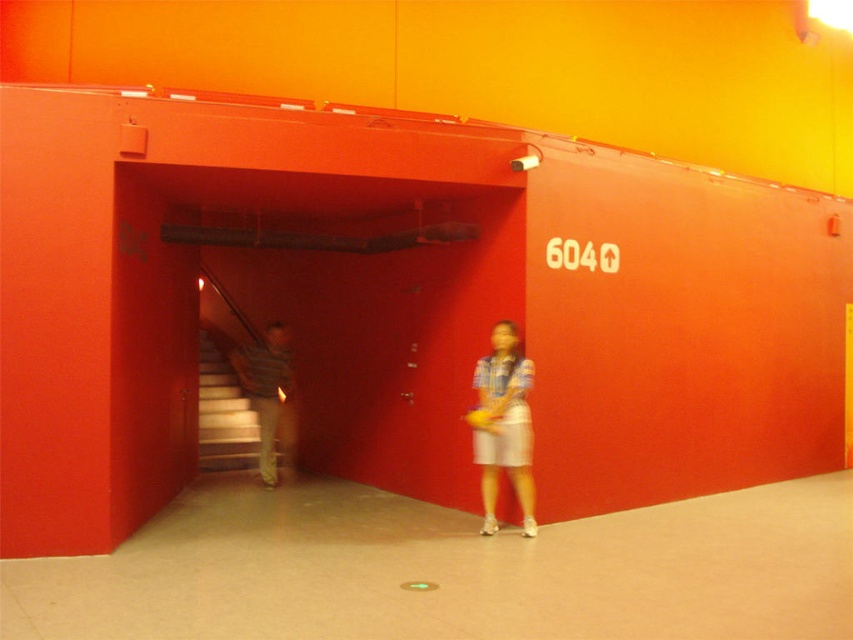
You are standing in the red interior space and see the point marked at coordinates [503,424]. What object is located at that position?

The point at coordinates [503,424] corresponds to the blue plaid shirt at center.

You are standing at point (235, 353) and want to walk to point (480, 484). Is the path between these two points clear of any obstacles?

Yes, the path between point (480, 484) and point (235, 353) is clear since point (480, 484) is in front of point (235, 353), indicating no obstructions between them.